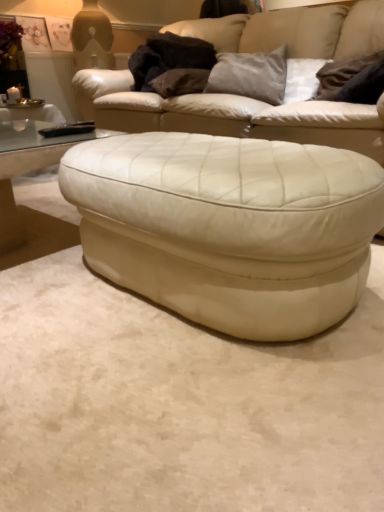
The image size is (384, 512). Find the location of `vacant area that lies in front of white leather ottoman at center`. vacant area that lies in front of white leather ottoman at center is located at coordinates (180, 399).